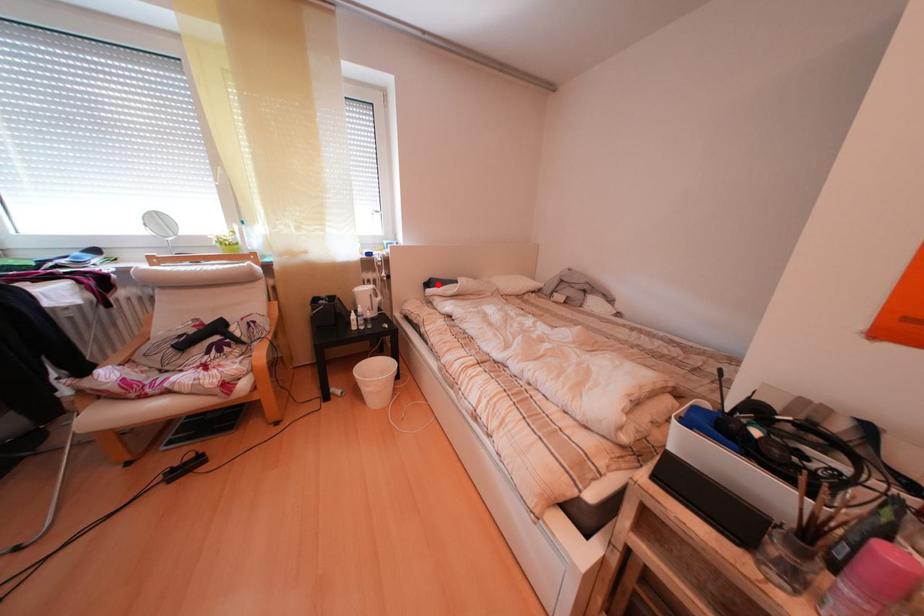
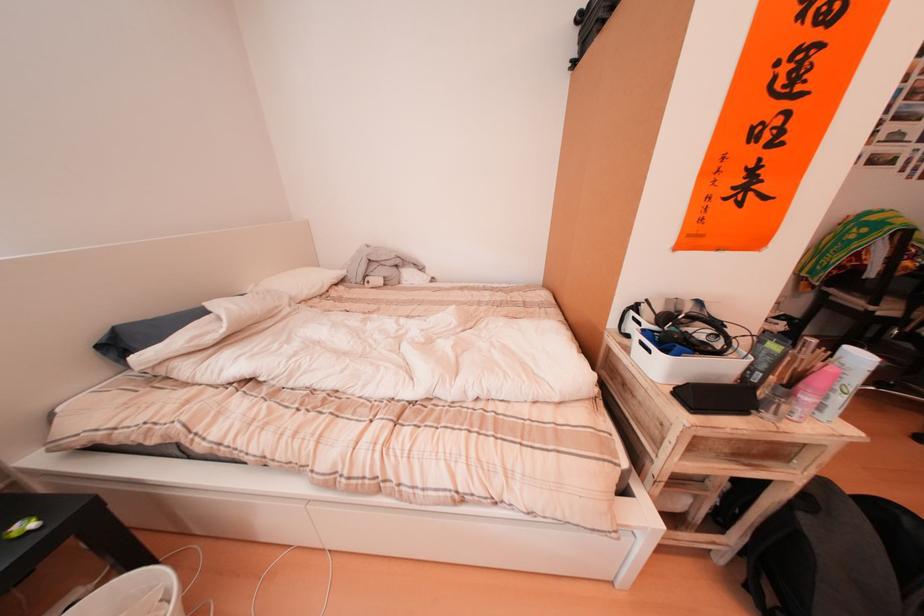
Find the pixel in the second image that matches the highlighted location in the first image.

(105, 339)